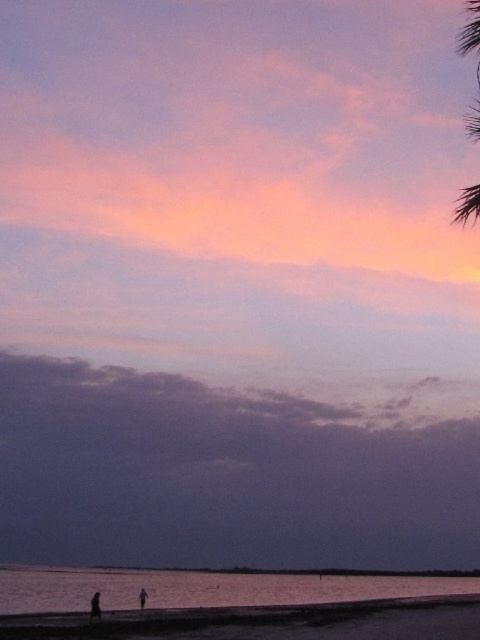
Does sandy beach at lower center have a lesser width compared to silhouette figure at lower center?

Incorrect, sandy beach at lower center's width is not less than silhouette figure at lower center's.

Does point (51, 618) come in front of point (144, 595)?

That is True.

Where is `sandy beach at lower center`? sandy beach at lower center is located at coordinates (263, 620).

Who is higher up, silhouette figure at lower left or silhouette figure at lower center?

Positioned higher is silhouette figure at lower left.

Is point (97, 602) positioned behind point (143, 608)?

No, (97, 602) is closer to viewer.

Does point (98, 595) lie behind point (143, 596)?

No.

The width and height of the screenshot is (480, 640). I want to click on silhouette figure at lower left, so click(95, 605).

Is silvery water at lower center smaller than silhouette figure at lower left?

Actually, silvery water at lower center might be larger than silhouette figure at lower left.

Can you confirm if silvery water at lower center is wider than silhouette figure at lower left?

Yes, silvery water at lower center is wider than silhouette figure at lower left.

Where is `silvery water at lower center`? Image resolution: width=480 pixels, height=640 pixels. silvery water at lower center is located at coordinates (203, 588).